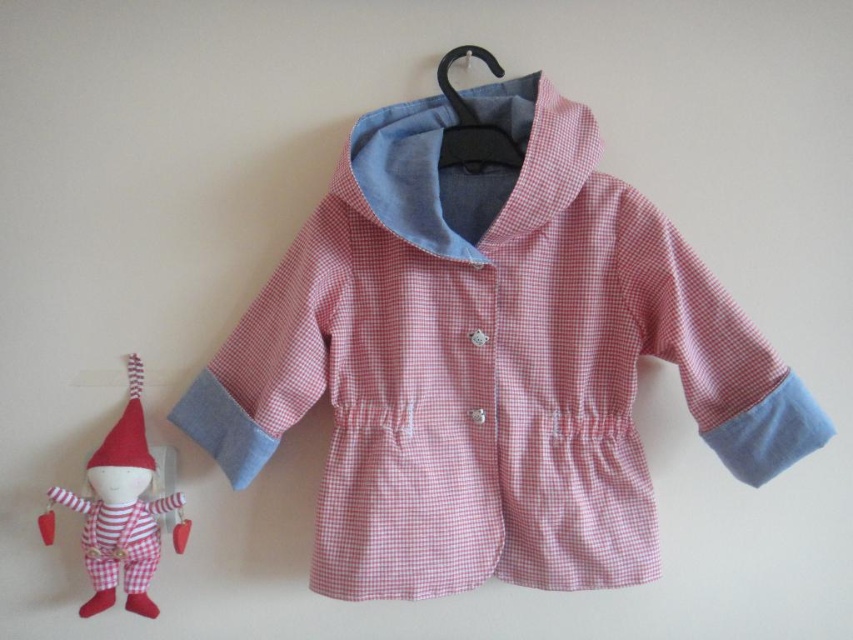
Question: Does red fabric elf at left have a smaller size compared to black plastic hanger at upper center?

Choices:
 (A) no
 (B) yes

Answer: (A)

Question: Which point is farther to the camera?

Choices:
 (A) (454, 426)
 (B) (471, 144)
 (C) (141, 468)

Answer: (A)

Question: Estimate the real-world distances between objects in this image. Which object is closer to the black plastic hanger at upper center?

Choices:
 (A) red felt christmas hat at left
 (B) red fabric elf at left
 (C) pink gingham fabric coat at center

Answer: (C)

Question: Is pink gingham fabric coat at center to the right of black plastic hanger at upper center from the viewer's perspective?

Choices:
 (A) no
 (B) yes

Answer: (A)

Question: Which object appears closest to the camera in this image?

Choices:
 (A) red felt christmas hat at left
 (B) pink gingham fabric coat at center
 (C) black plastic hanger at upper center
 (D) red fabric elf at left

Answer: (B)

Question: Can you confirm if pink gingham fabric coat at center is smaller than red fabric elf at left?

Choices:
 (A) no
 (B) yes

Answer: (A)